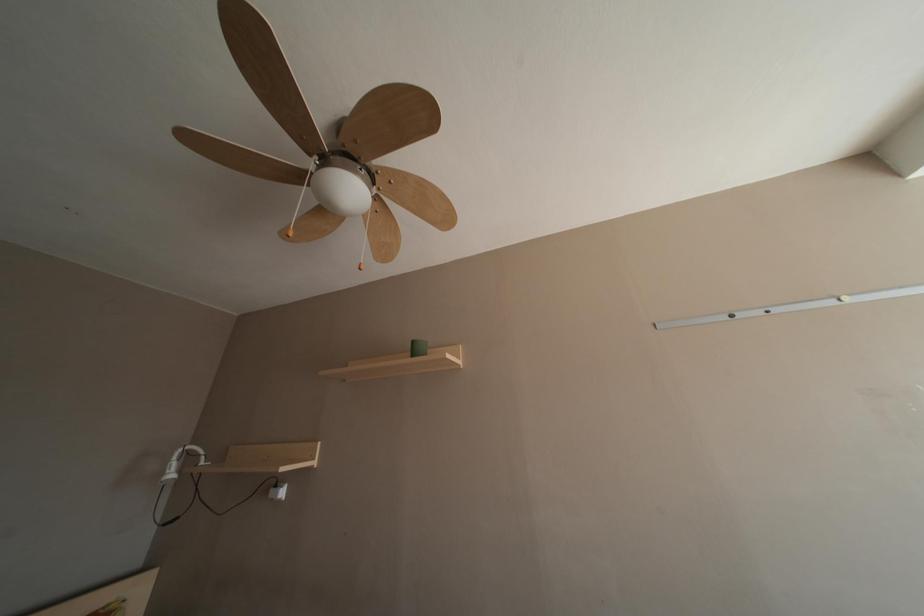
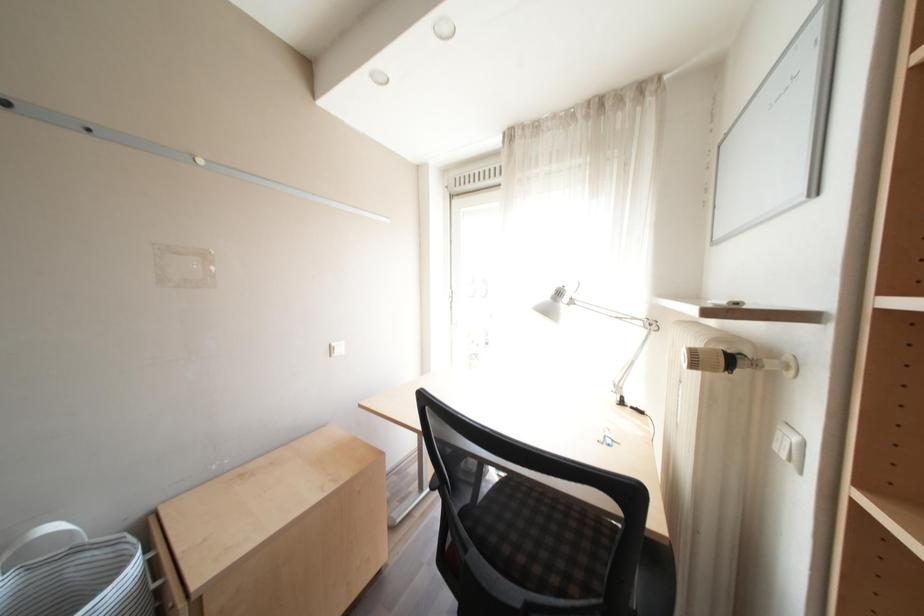
Question: Based on the continuous images, in which direction is the camera rotating? Reply with the corresponding letter.

Choices:
 (A) Left
 (B) Right
 (C) Up
 (D) Down

Answer: (B)